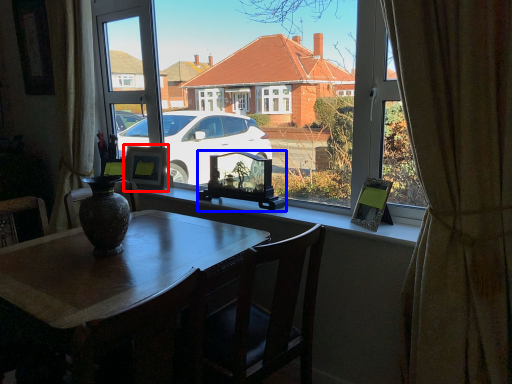
Question: Which object appears closest to the camera in this image, picture frame (highlighted by a red box) or picture frame (highlighted by a blue box)?

Choices:
 (A) picture frame
 (B) picture frame

Answer: (B)